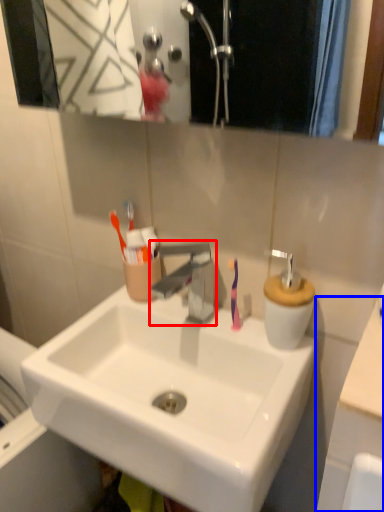
Question: Which object appears farthest to the camera in this image, tap (highlighted by a red box) or counter top (highlighted by a blue box)?

Choices:
 (A) tap
 (B) counter top

Answer: (A)